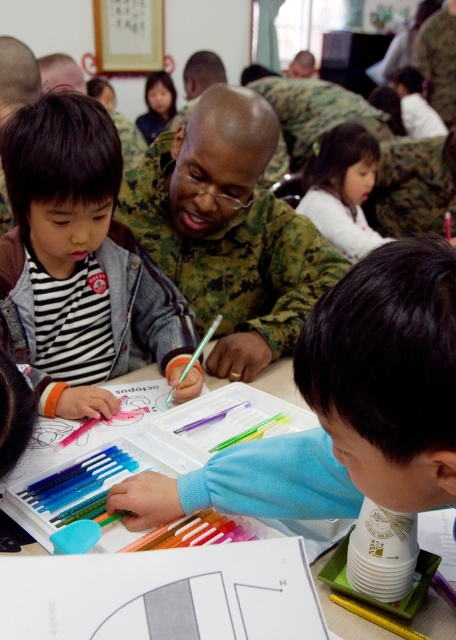
Question: Can you confirm if smooth blue sweater at lower right is positioned below white plastic table at center?

Choices:
 (A) yes
 (B) no

Answer: (B)

Question: Does smooth blue sweater at lower right have a larger size compared to striped fabric shirt at center?

Choices:
 (A) no
 (B) yes

Answer: (A)

Question: Among these objects, which one is farthest from the camera?

Choices:
 (A) white plastic table at center
 (B) striped fabric shirt at center

Answer: (B)

Question: Which point is farther to the camera?

Choices:
 (A) white matte shirt at upper center
 (B) striped fabric shirt at center
 (C) white plastic table at center
 (D) smooth blue sweater at lower right

Answer: (A)

Question: Can you confirm if smooth blue sweater at lower right is positioned below white matte shirt at upper center?

Choices:
 (A) no
 (B) yes

Answer: (B)

Question: Which point is farther to the camera?

Choices:
 (A) (356, 193)
 (B) (270, 372)
 (C) (265, 100)
 (D) (351, 305)

Answer: (A)